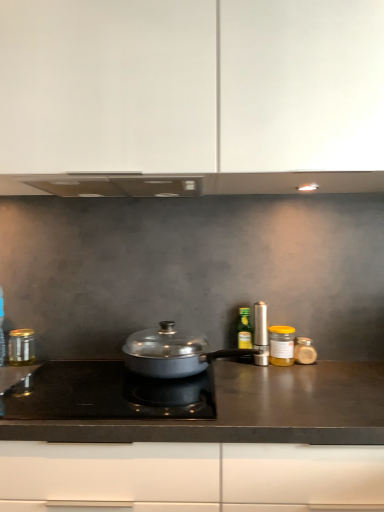
At what (x,y) coordinates should I click in order to perform the action: click on vacant area that lies to the right of yellow glass jar at right, the 5th kitchen appliance positioned from the left. Please return your answer as a coordinate pair (x, y). The height and width of the screenshot is (512, 384). Looking at the image, I should click on (334, 365).